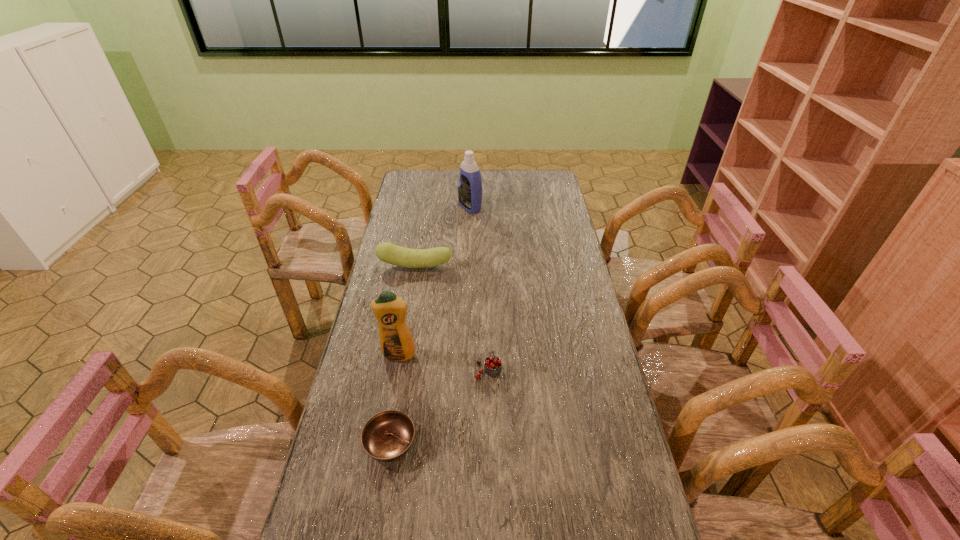
Select which object appears as the third closest to the left detergent. Please provide its 2D coordinates. Your answer should be formatted as a tuple, i.e. [(x, y)], where the tuple contains the x and y coordinates of a point satisfying the conditions above.

[(387, 252)]

Where is `object that stands as the third closest to the fourth nearest object`? The image size is (960, 540). object that stands as the third closest to the fourth nearest object is located at coordinates (492, 365).

Image resolution: width=960 pixels, height=540 pixels. In order to click on free spot that satisfies the following two spatial constraints: 1. on the back side of the farther detergent; 2. on the left side of the second farthest object in this screenshot , I will do `click(425, 207)`.

I want to click on free space that satisfies the following two spatial constraints: 1. on the back side of the farthest object; 2. on the right side of the fourth nearest object, so click(x=425, y=207).

The width and height of the screenshot is (960, 540). Find the location of `free spot that satisfies the following two spatial constraints: 1. on the back side of the farthest object; 2. on the left side of the nearest object`. free spot that satisfies the following two spatial constraints: 1. on the back side of the farthest object; 2. on the left side of the nearest object is located at coordinates click(x=429, y=207).